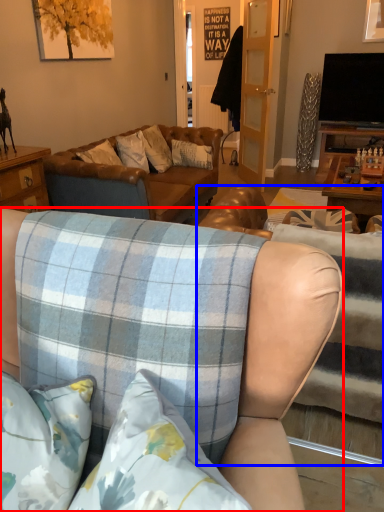
Question: Which object is further to the camera taking this photo, studio couch (highlighted by a red box) or studio couch (highlighted by a blue box)?

Choices:
 (A) studio couch
 (B) studio couch

Answer: (B)